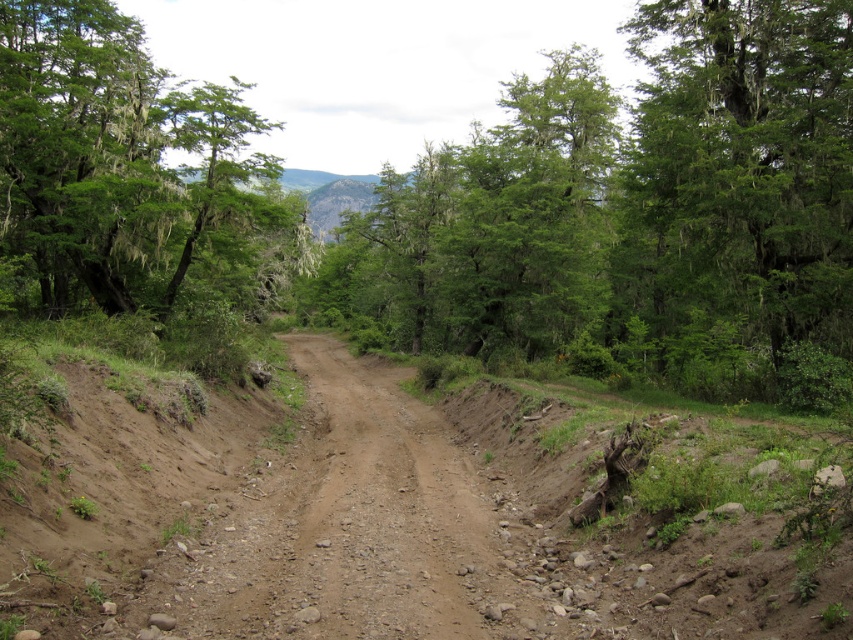
Which of these two, green leafy tree at upper center or green matte tree at upper right, stands taller?

With more height is green leafy tree at upper center.

Is point (607, 180) positioned in front of point (802, 257)?

That is False.

Locate an element on the screen. This screenshot has height=640, width=853. green leafy tree at upper center is located at coordinates (634, 212).

Between green leafy tree at upper center and green mossy tree at upper left, which one appears on the left side from the viewer's perspective?

green mossy tree at upper left is more to the left.

What are the coordinates of `green leafy tree at upper center` in the screenshot? It's located at (634, 212).

Between point (750, 179) and point (273, 532), which one is positioned behind?

Positioned behind is point (750, 179).

Is green leafy tree at upper center positioned in front of brown gravelly dirt track at center?

No, it is not.

Between point (352, 301) and point (289, 586), which one is positioned behind?

The point (352, 301) is more distant.

Find the location of a particular element. green leafy tree at upper center is located at coordinates (634, 212).